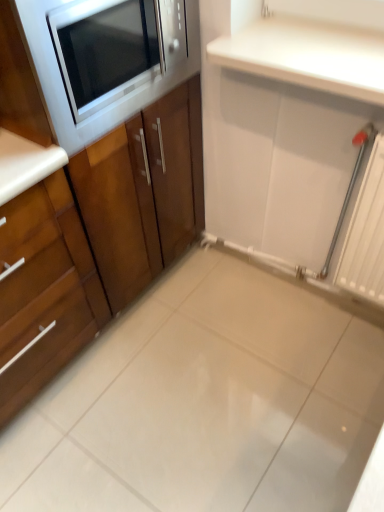
Question: Is white glossy ceramic tile at center wider or thinner than wooden cabinet at left, which appears as the first cabinetry when viewed from the left?

Choices:
 (A) thin
 (B) wide

Answer: (B)

Question: Is white glossy ceramic tile at center situated inside wooden cabinet at left, placed as the 2th cabinetry when sorted from right to left, or outside?

Choices:
 (A) inside
 (B) outside

Answer: (B)

Question: Estimate the real-world distances between objects in this image. Which object is closer to the white glossy countertop at upper right?

Choices:
 (A) wooden cabinet at left, arranged as the first cabinetry when viewed from the right
 (B) wooden cabinet at left, placed as the 2th cabinetry when sorted from right to left
 (C) white glossy ceramic tile at center
 (D) matte black microwave at upper left

Answer: (D)

Question: Which object is positioned closest to the wooden cabinet at left, the second cabinetry in the left-to-right sequence?

Choices:
 (A) white glossy ceramic tile at center
 (B) white glossy countertop at upper right
 (C) matte black microwave at upper left
 (D) wooden cabinet at left, which appears as the first cabinetry when viewed from the left

Answer: (D)